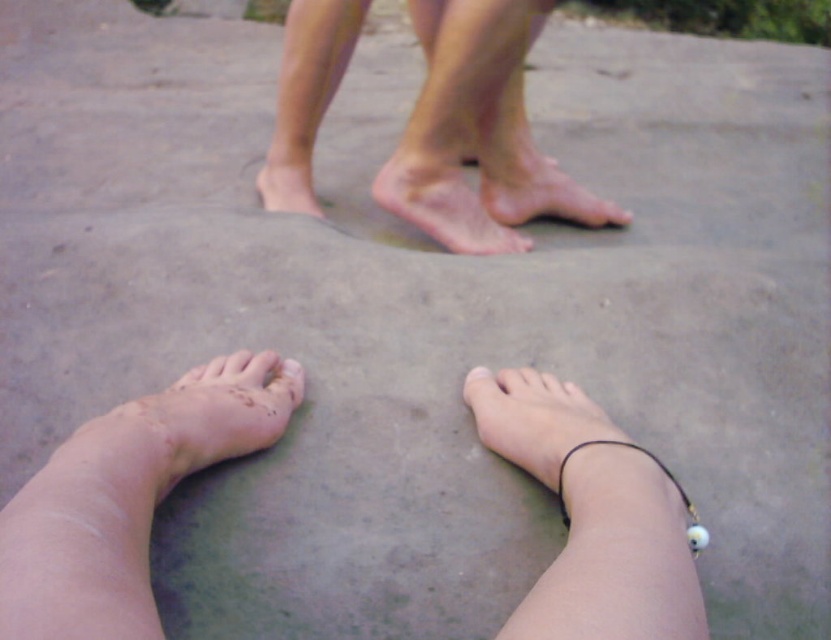
Question: Does skinny bare feet at upper center appear on the left side of pale skin foot at upper center?

Choices:
 (A) yes
 (B) no

Answer: (B)

Question: Among these points, which one is nearest to the camera?

Choices:
 (A) (499, 67)
 (B) (466, 378)

Answer: (B)

Question: Which point appears farthest from the camera in this image?

Choices:
 (A) (637, 451)
 (B) (424, 164)

Answer: (B)

Question: Can you confirm if pale skin at lower center is thinner than black leather anklet at lower center?

Choices:
 (A) yes
 (B) no

Answer: (B)

Question: Among these points, which one is nearest to the camera?

Choices:
 (A) (300, 369)
 (B) (473, 371)
 (C) (209, 444)

Answer: (C)

Question: From the image, what is the correct spatial relationship of skinny black anklet at lower center in relation to black leather anklet at lower center?

Choices:
 (A) below
 (B) above

Answer: (B)